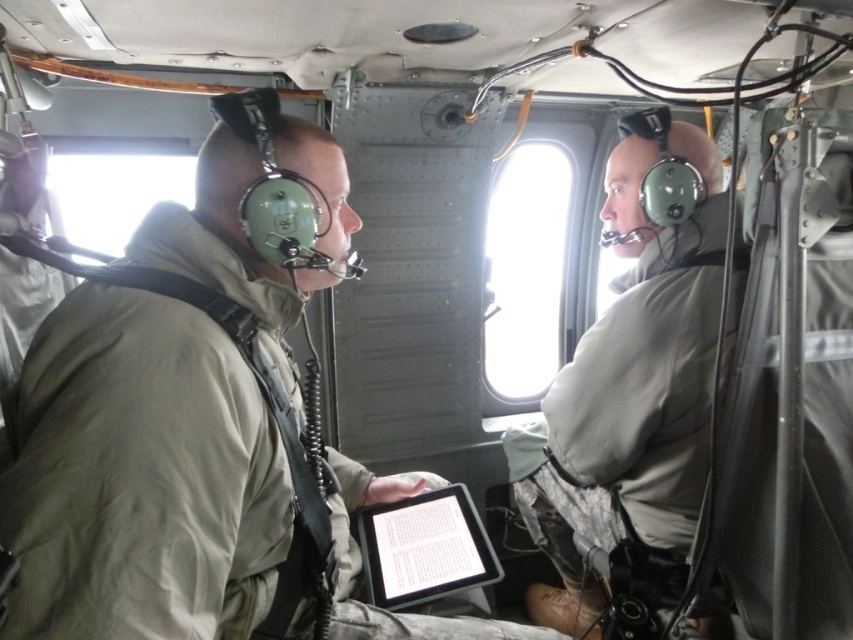
Between matte green helmet at center and black matte tablet at center, which one is positioned higher?

black matte tablet at center is above.

Which of these two, matte green helmet at center or black matte tablet at center, stands shorter?

With less height is black matte tablet at center.

Is point (698, 422) positioned after point (404, 518)?

No, it is not.

The image size is (853, 640). What are the coordinates of `matte green helmet at center` in the screenshot? It's located at [630, 385].